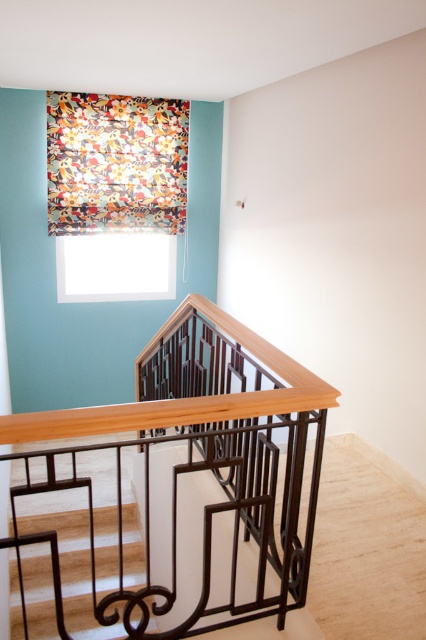
Question: Considering the real-world distances, which object is closest to the woodenmetallicbalustrade at center?

Choices:
 (A) white matte window at upper center
 (B) floral fabric at upper left

Answer: (A)

Question: Which object is the closest to the floral fabric at upper left?

Choices:
 (A) woodenmetallicbalustrade at center
 (B) white matte window at upper center

Answer: (B)

Question: Can you confirm if woodenmetallicbalustrade at center is smaller than white matte window at upper center?

Choices:
 (A) no
 (B) yes

Answer: (A)

Question: Can you confirm if woodenmetallicbalustrade at center is thinner than floral fabric at upper left?

Choices:
 (A) no
 (B) yes

Answer: (B)

Question: Which point is closer to the camera?

Choices:
 (A) woodenmetallicbalustrade at center
 (B) floral fabric at upper left
 (C) white matte window at upper center

Answer: (A)

Question: Can you confirm if floral fabric at upper left is positioned to the left of white matte window at upper center?

Choices:
 (A) no
 (B) yes

Answer: (A)